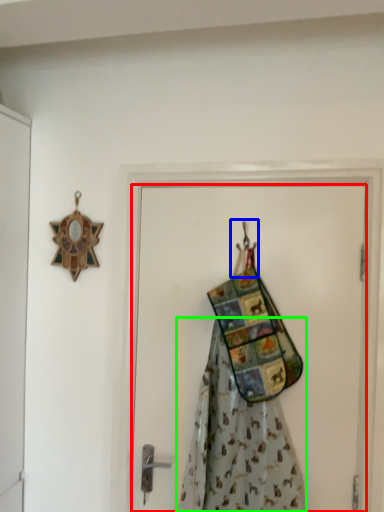
Question: Which object is the farthest from door (highlighted by a red box)? Choose among these: hanger (highlighted by a blue box) or fancy dress (highlighted by a green box).

Choices:
 (A) hanger
 (B) fancy dress

Answer: (A)